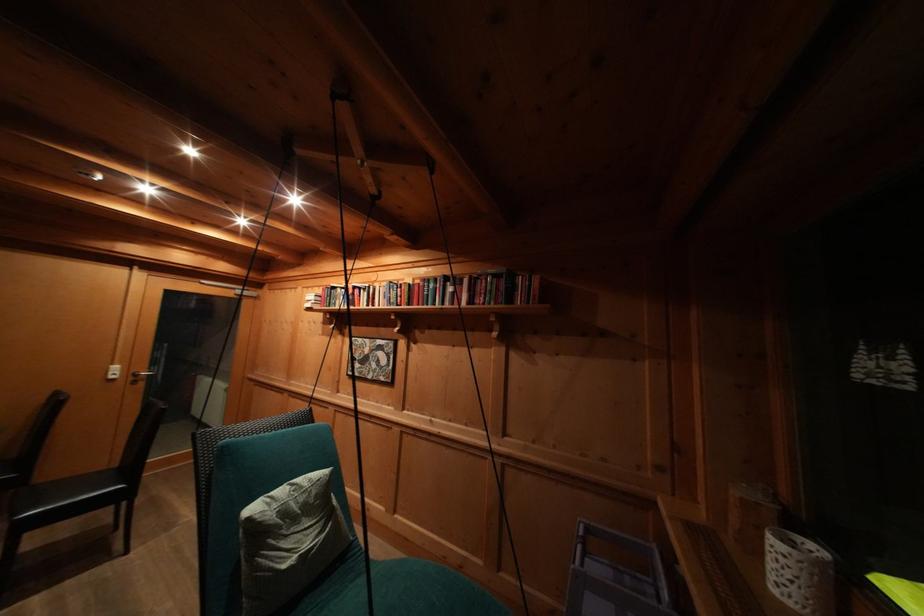
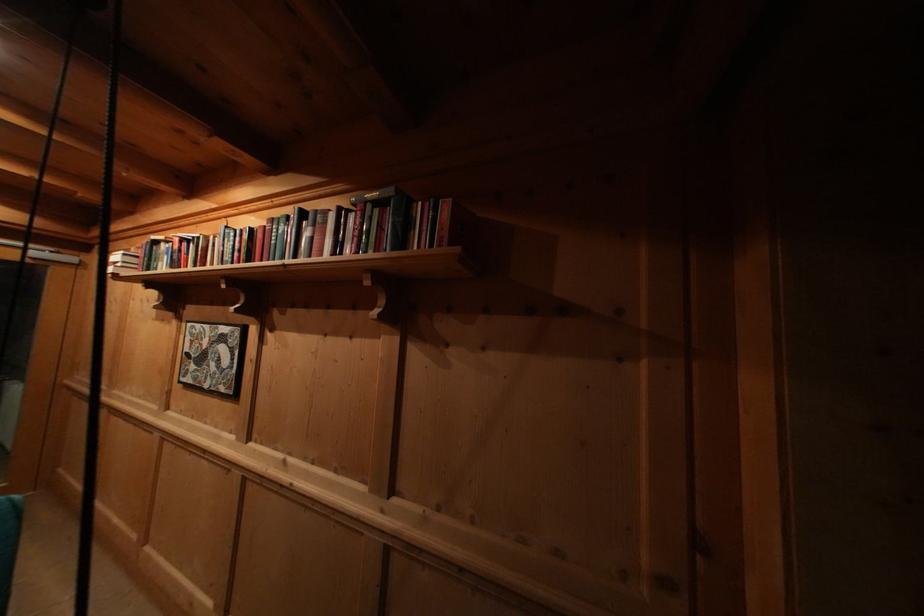
Where in the second image is the point corresponding to pixel 367 345 from the first image?

(204, 331)